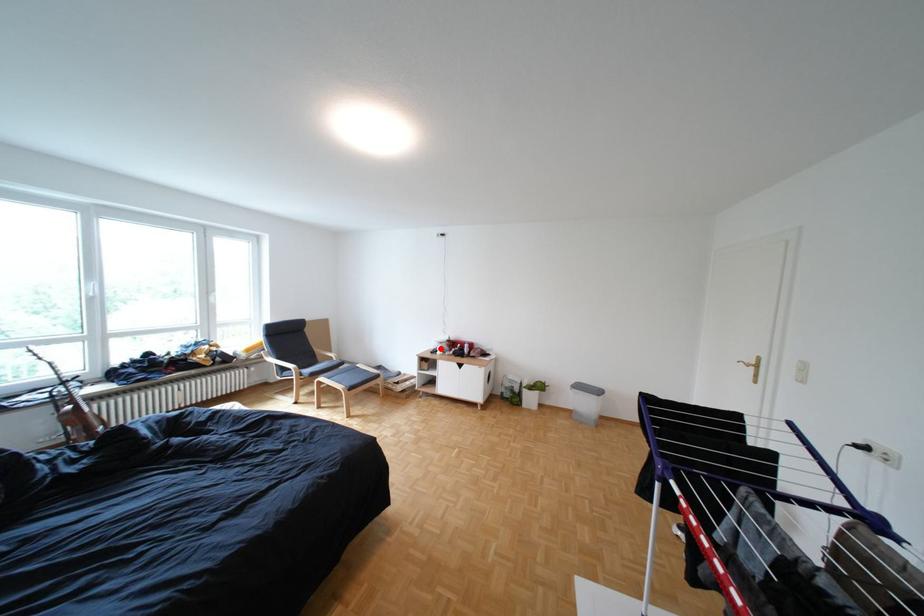
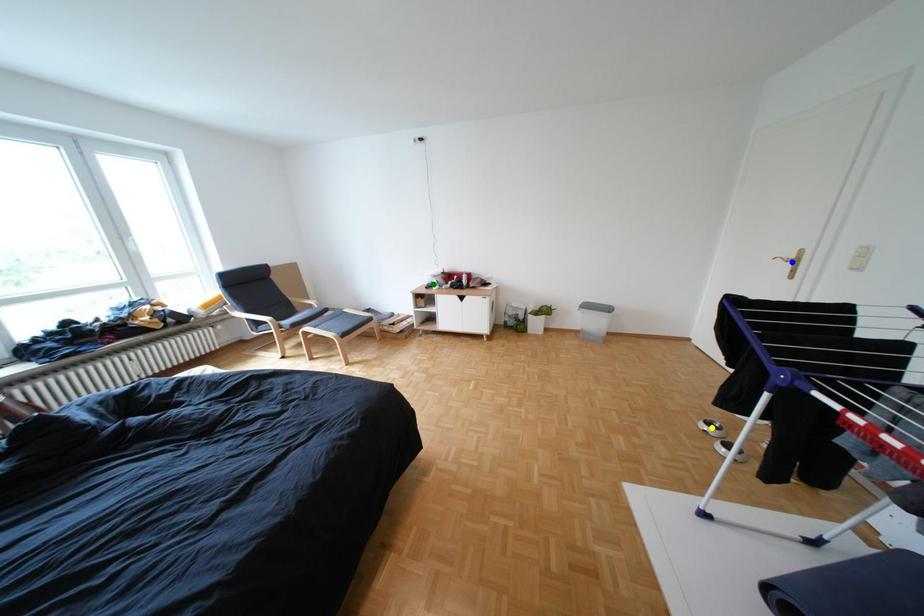
Question: I am providing you with two images of the same scene from different viewpoints. A red point is marked on the first image. You are given multiple points on the second image. Which point in image 2 represents the same 3d spot as the red point in image 1?

Choices:
 (A) blue point
 (B) green point
 (C) yellow point

Answer: (B)